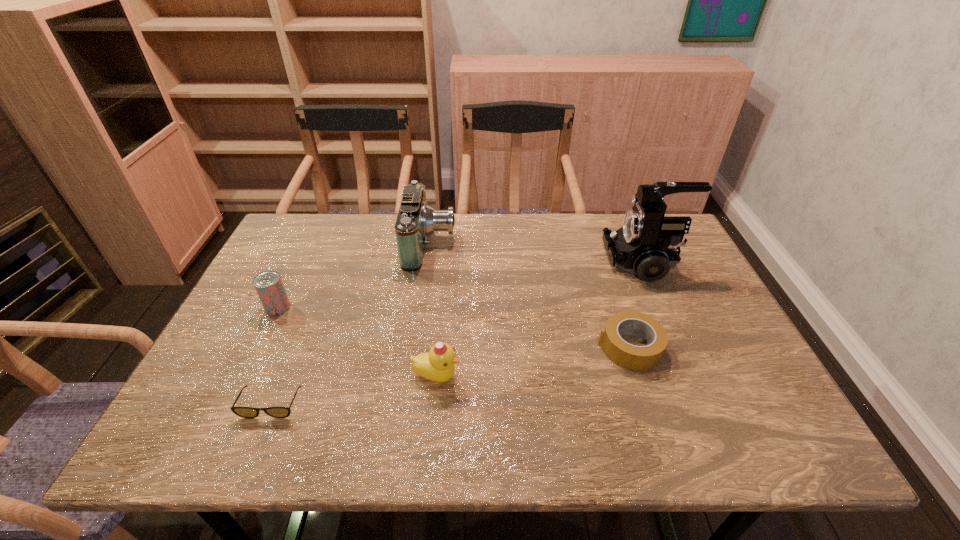
Where is `unoccupied area between the third shortest object and the duckling`? This screenshot has width=960, height=540. unoccupied area between the third shortest object and the duckling is located at coordinates (357, 342).

Where is `empty space between the tallest object and the second shortest object`? empty space between the tallest object and the second shortest object is located at coordinates (636, 305).

The image size is (960, 540). I want to click on free point between the left camcorder and the duct tape, so click(x=530, y=296).

Identify the location of free space between the sunglasses and the taller camcorder. Image resolution: width=960 pixels, height=540 pixels. (457, 333).

Find the location of `empty space that is in between the tallest object and the third farthest object`. empty space that is in between the tallest object and the third farthest object is located at coordinates (461, 285).

This screenshot has width=960, height=540. Identify the location of unoccupied area between the left camcorder and the third tallest object. (433, 310).

Locate an element on the screen. Image resolution: width=960 pixels, height=540 pixels. unoccupied position between the duct tape and the third shortest object is located at coordinates (454, 327).

You are a GUI agent. You are given a task and a screenshot of the screen. Output one action in this format:
    pyautogui.click(x=<x>, y=<y>)
    Task: Click on the empty space between the third tallest object and the beer can
    The height and width of the screenshot is (540, 960).
    Given the screenshot: What is the action you would take?
    pyautogui.click(x=357, y=342)

Find the location of `free space between the duct tape and the tallest object`. free space between the duct tape and the tallest object is located at coordinates (636, 305).

Identify the location of object that ranks as the third closest to the duckling. (416, 220).